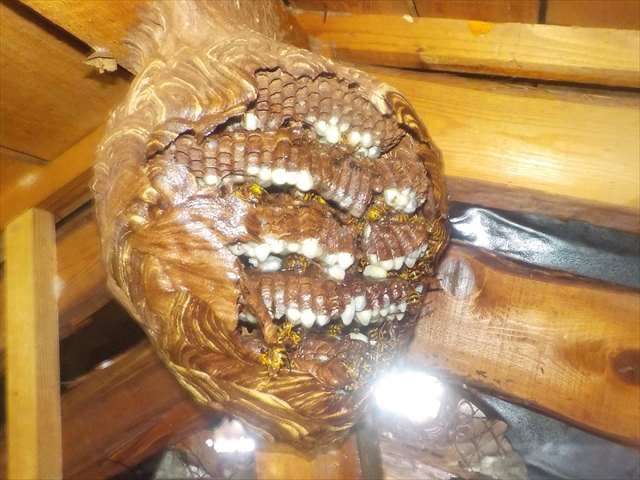
Identify the location of right wall. (514, 290).